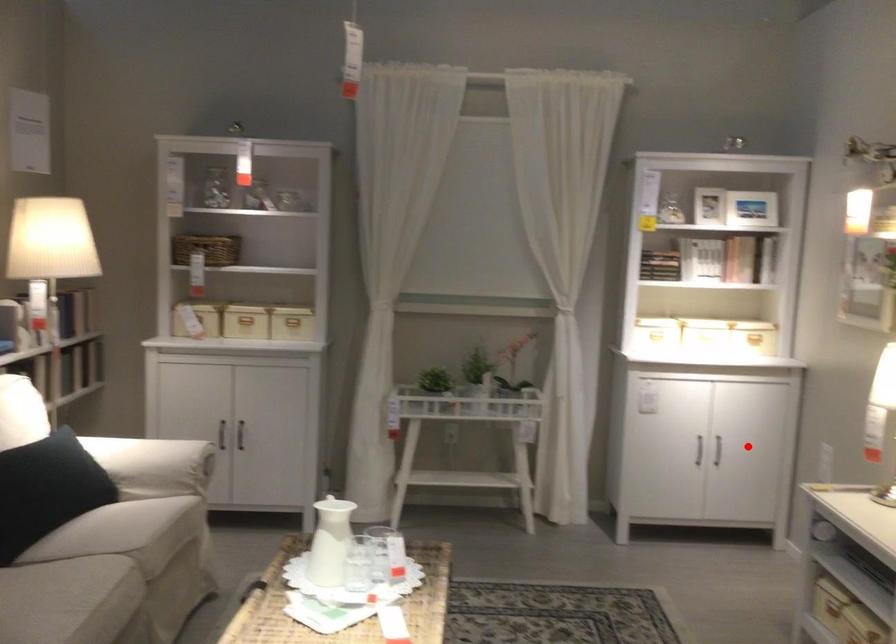
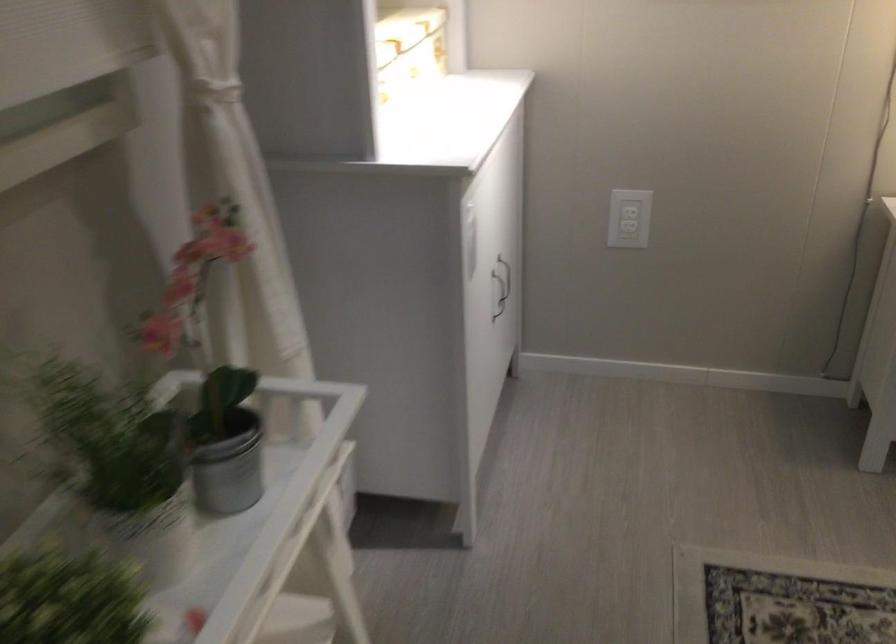
Where in the second image is the point corresponding to the highlighted location from the first image?

(501, 292)